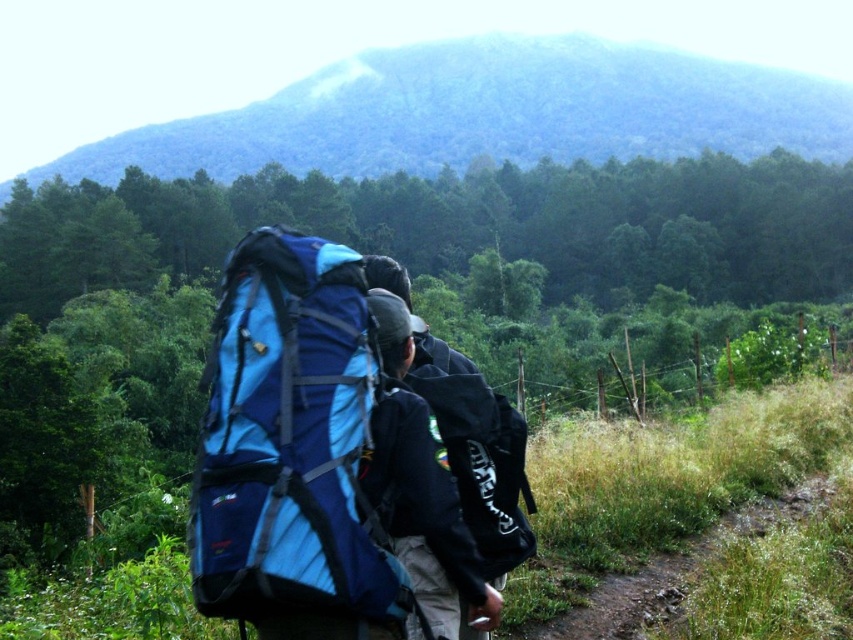
Question: Does green textured mountain at upper center have a larger size compared to brown dirt path at lower right?

Choices:
 (A) no
 (B) yes

Answer: (B)

Question: Which point is farther from the camera taking this photo?

Choices:
 (A) [308, 384]
 (B) [590, 637]
 (C) [505, 548]

Answer: (B)

Question: Observing the image, what is the correct spatial positioning of blue fabric backpack at center in reference to brown dirt path at lower right?

Choices:
 (A) above
 (B) below

Answer: (A)

Question: Does black matte backpack at center have a smaller size compared to brown dirt path at lower right?

Choices:
 (A) yes
 (B) no

Answer: (A)

Question: Estimate the real-world distances between objects in this image. Which object is closer to the green textured mountain at upper center?

Choices:
 (A) brown dirt path at lower right
 (B) blue fabric backpack at center
 (C) black matte backpack at center

Answer: (C)

Question: Which point is closer to the camera?

Choices:
 (A) brown dirt path at lower right
 (B) blue fabric backpack at center

Answer: (B)